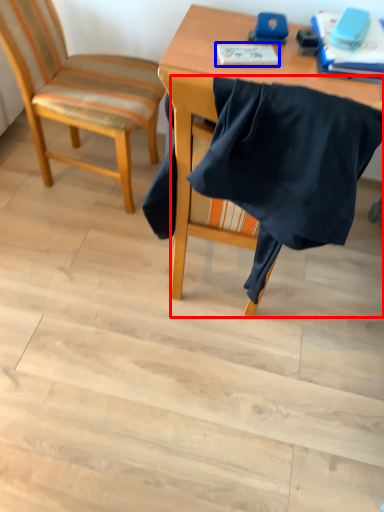
Question: Which point is closer to the camera, chair (highlighted by a red box) or notebook (highlighted by a blue box)?

Choices:
 (A) chair
 (B) notebook

Answer: (A)